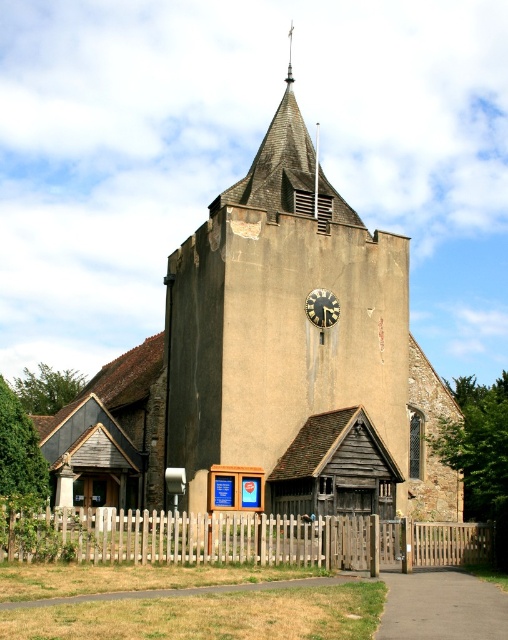
Between brown stone church at center and black metal clock at center, which one appears on the right side from the viewer's perspective?

black metal clock at center

Is brown stone church at center further to the viewer compared to black metal clock at center?

No.

Describe the element at coordinates (269, 364) in the screenshot. This screenshot has width=508, height=640. I see `brown stone church at center` at that location.

I want to click on brown stone church at center, so click(x=269, y=364).

Is white wooden fence at lower center further to the viewer compared to black metal clock at center?

No, it is not.

Who is more distant from viewer, [136,516] or [327,289]?

The point [327,289] is more distant.

Which is in front, point (249, 556) or point (318, 320)?

Point (249, 556) is in front.

This screenshot has height=640, width=508. In order to click on white wooden fence at lower center in this screenshot , I will do `click(243, 540)`.

Is brown stone church at center to the right of white wooden fence at lower center from the viewer's perspective?

No, brown stone church at center is not to the right of white wooden fence at lower center.

The image size is (508, 640). Identify the location of brown stone church at center. (269, 364).

Where is `brown stone church at center`? brown stone church at center is located at coordinates (269, 364).